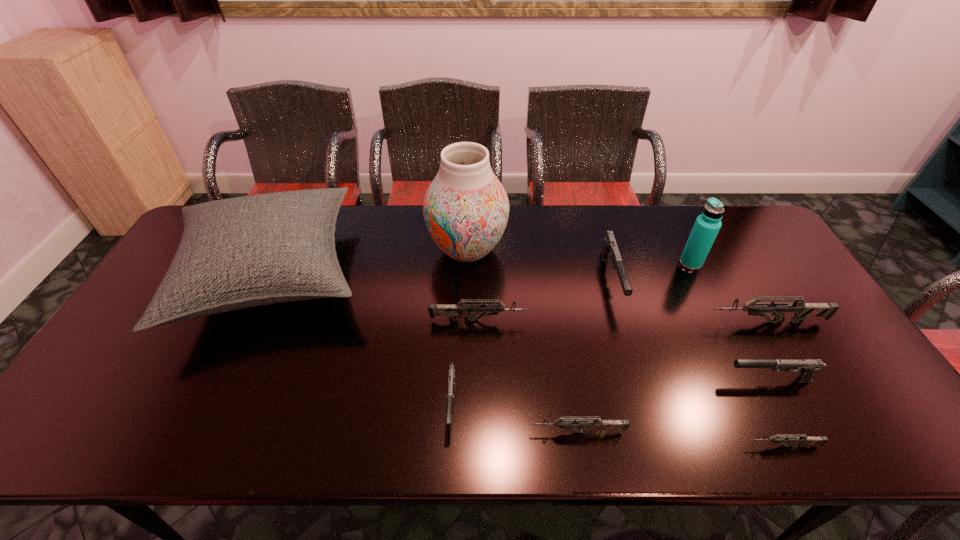
Locate an element on the screen. cushion at the far edge is located at coordinates (242, 252).

At what (x,y) coordinates should I click in order to perform the action: click on object that is at the left edge. Please return your answer as a coordinate pair (x, y). The height and width of the screenshot is (540, 960). Looking at the image, I should click on (242, 252).

In order to click on object present at the far left corner in this screenshot , I will do `click(242, 252)`.

In the image, there is a desktop. What are the coordinates of `vacant space at the far edge` in the screenshot? It's located at (558, 222).

Locate an element on the screen. This screenshot has height=540, width=960. free space at the near edge of the desktop is located at coordinates click(663, 425).

At what (x,y) coordinates should I click in order to perform the action: click on free space at the right edge of the desktop. Please return your answer as a coordinate pair (x, y). Looking at the image, I should click on (861, 383).

The height and width of the screenshot is (540, 960). In order to click on free space at the far right corner of the desktop in this screenshot , I will do `click(756, 231)`.

In the image, there is a desktop. Identify the location of vacant area at the near right corner. The image size is (960, 540). (911, 441).

This screenshot has height=540, width=960. Find the location of `empty space between the second gray gun from right to left and the smallest grey gun`. empty space between the second gray gun from right to left and the smallest grey gun is located at coordinates (697, 363).

The height and width of the screenshot is (540, 960). Identify the location of free space between the fourth gun from left to right and the biggest grey gun. (689, 301).